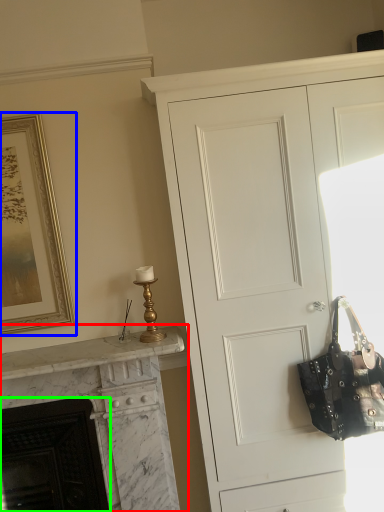
Question: Which is nearer to the fireplace (highlighted by a red box)? picture frame (highlighted by a blue box) or fireplace (highlighted by a green box).

Choices:
 (A) picture frame
 (B) fireplace

Answer: (B)